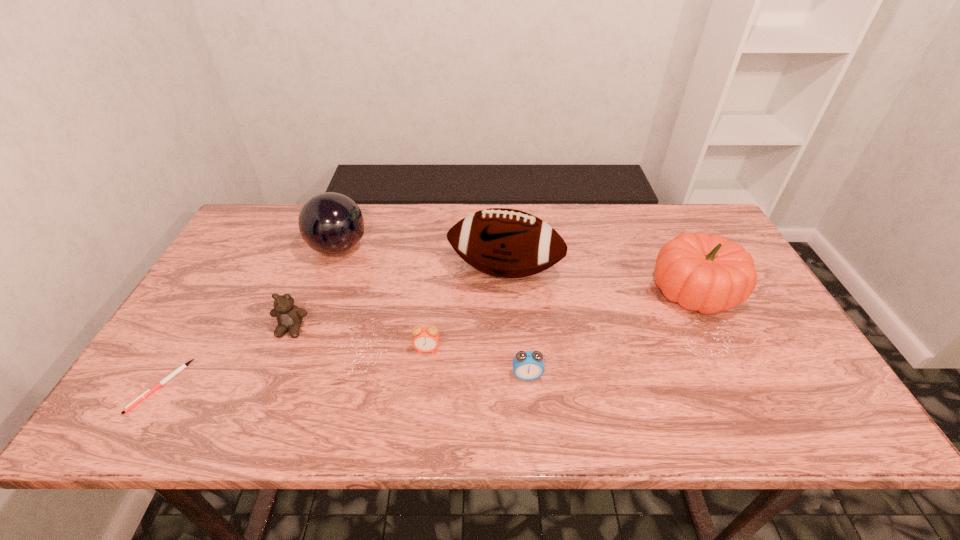
You are a GUI agent. You are given a task and a screenshot of the screen. Output one action in this format:
    pyautogui.click(x=<x>, y=<y>)
    Task: Click on the football (American)
    The height and width of the screenshot is (540, 960).
    Given the screenshot: What is the action you would take?
    pyautogui.click(x=507, y=243)

Where is `bowling ball`? bowling ball is located at coordinates (330, 223).

In order to click on the rightmost object in this screenshot , I will do `click(706, 273)`.

This screenshot has width=960, height=540. I want to click on teddy bear, so tap(289, 317).

Find the location of `the left alarm clock`. the left alarm clock is located at coordinates (425, 339).

At what (x,y) coordinates should I click in order to perform the action: click on the fourth object from right to left. Please return your answer as a coordinate pair (x, y). This screenshot has width=960, height=540. Looking at the image, I should click on (425, 339).

Identify the location of the second shortest object. (527, 365).

Where is `the right alarm clock`? The height and width of the screenshot is (540, 960). the right alarm clock is located at coordinates pos(527,365).

This screenshot has height=540, width=960. In order to click on pen in this screenshot , I will do `click(149, 391)`.

Where is `the shortest object`? the shortest object is located at coordinates (149, 391).